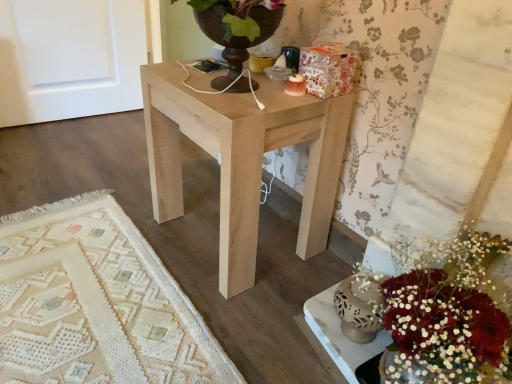
Question: From a real-world perspective, is white matte vase at lower right positioned above or below natural wood table at center?

Choices:
 (A) above
 (B) below

Answer: (B)

Question: Would you say white matte vase at lower right is inside or outside natural wood table at center?

Choices:
 (A) inside
 (B) outside

Answer: (B)

Question: Considering the relative positions of white matte vase at lower right and natural wood table at center in the image provided, is white matte vase at lower right to the left or to the right of natural wood table at center?

Choices:
 (A) right
 (B) left

Answer: (A)

Question: Considering their positions, is natural wood table at center located in front of or behind white matte vase at lower right?

Choices:
 (A) behind
 (B) front

Answer: (A)

Question: Is natural wood table at center spatially inside white matte vase at lower right, or outside of it?

Choices:
 (A) outside
 (B) inside

Answer: (A)

Question: From a real-world perspective, relative to white matte vase at lower right, is natural wood table at center vertically above or below?

Choices:
 (A) above
 (B) below

Answer: (A)

Question: Is natural wood table at center wider or thinner than white matte vase at lower right?

Choices:
 (A) wide
 (B) thin

Answer: (A)